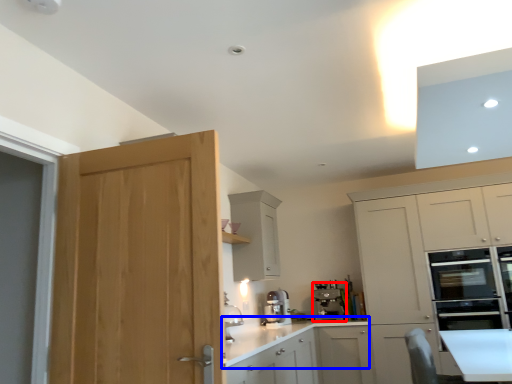
Question: Among these objects, which one is nearest to the camera, kitchen appliance (highlighted by a red box) or countertop (highlighted by a blue box)?

Choices:
 (A) kitchen appliance
 (B) countertop

Answer: (B)